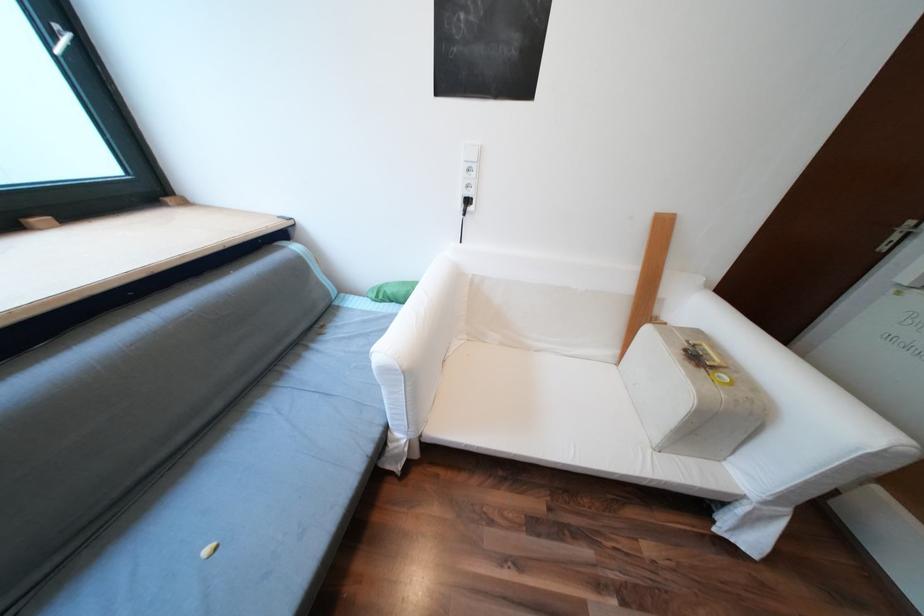
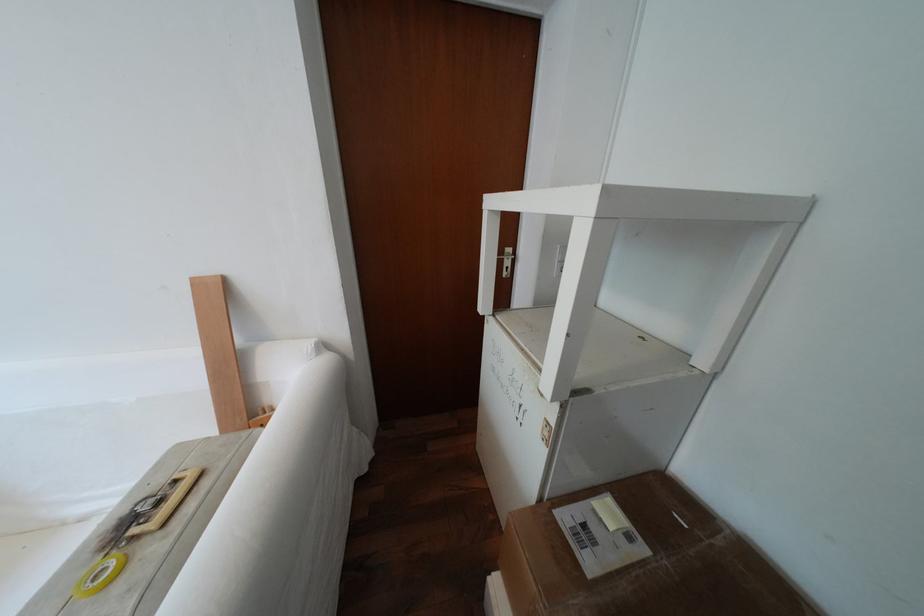
Question: The images are taken continuously from a first-person perspective. In which direction are you moving?

Choices:
 (A) Left
 (B) Right
 (C) Forward
 (D) Backward

Answer: (B)